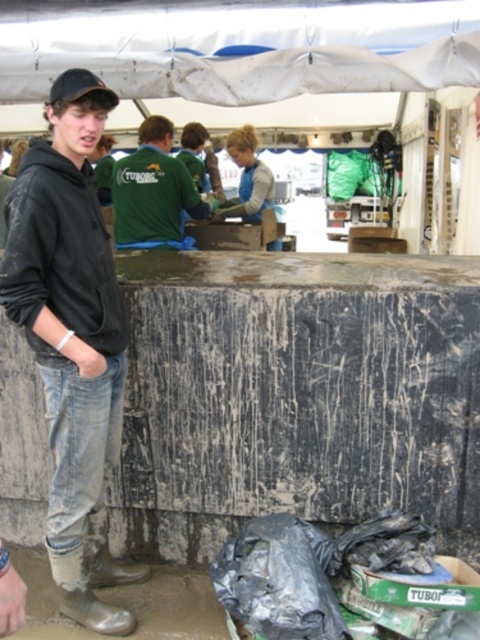
Is green fabric shirt at center positioned behind black matte baseball cap at upper left?

Yes.

Does green fabric shirt at center have a lesser height compared to black matte baseball cap at upper left?

In fact, green fabric shirt at center may be taller than black matte baseball cap at upper left.

Find the location of a particular element. green fabric shirt at center is located at coordinates (154, 193).

Image resolution: width=480 pixels, height=640 pixels. What are the coordinates of `green fabric shirt at center` in the screenshot? It's located at (154, 193).

Between point (9, 92) and point (58, 99), which one is positioned in front?

Point (58, 99) is more forward.

Which of these two, white tarpaulin canopy at upper center or black matte baseball cap at upper left, stands shorter?

Standing shorter between the two is black matte baseball cap at upper left.

Measure the distance between point (445, 49) and camera.

Point (445, 49) is 8.36 feet from camera.

You are a GUI agent. You are given a task and a screenshot of the screen. Output one action in this format:
    pyautogui.click(x=<x>, y=<y>)
    Task: Click on the white tarpaulin canopy at upper center
    This screenshot has width=480, height=640.
    Given the screenshot: What is the action you would take?
    coord(244,51)

Is black matte hoodie at left further to the viewer compared to white tarpaulin canopy at upper center?

No, it is not.

Measure the distance between black matte hoodie at left and camera.

black matte hoodie at left and camera are 2.04 meters apart from each other.

You are a GUI agent. You are given a task and a screenshot of the screen. Output one action in this format:
    pyautogui.click(x=<x>, y=<y>)
    Task: Click on the black matte hoodie at left
    
    Given the screenshot: What is the action you would take?
    pyautogui.click(x=72, y=346)